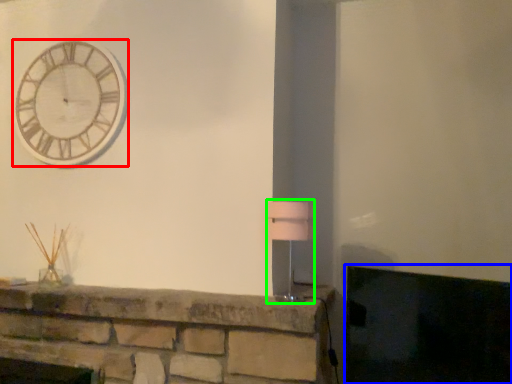
Question: Estimate the real-world distances between objects in this image. Which object is closer to wall clock (highlighted by a red box), fireplace (highlighted by a blue box) or table lamp (highlighted by a green box)?

Choices:
 (A) fireplace
 (B) table lamp

Answer: (B)